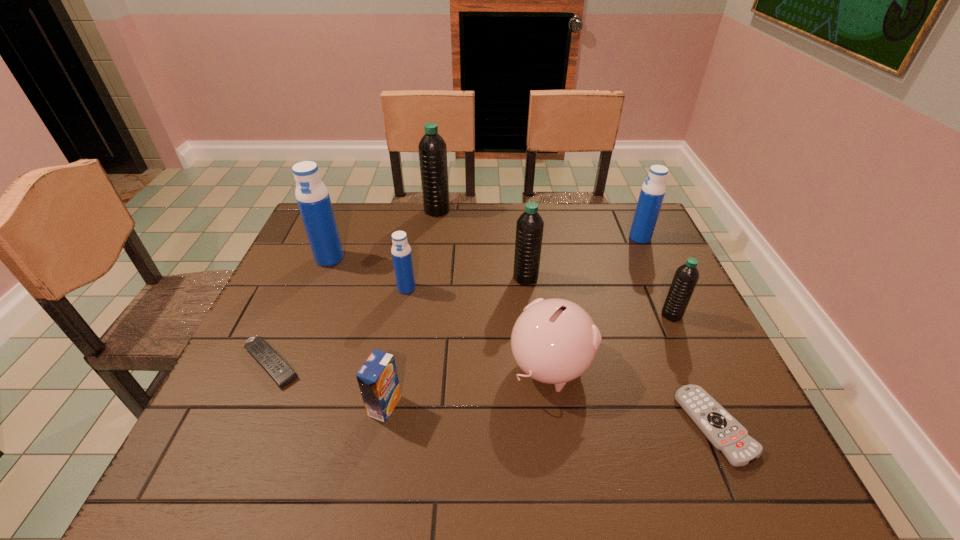
The height and width of the screenshot is (540, 960). Identify the location of remote control located in the left edge section of the desktop. (266, 356).

You are a GUI agent. You are given a task and a screenshot of the screen. Output one action in this format:
    pyautogui.click(x=<x>, y=<y>)
    Task: Click on the remote control present at the right edge
    
    Given the screenshot: What is the action you would take?
    pyautogui.click(x=724, y=432)

Where is `object that is at the far right corner`? This screenshot has width=960, height=540. object that is at the far right corner is located at coordinates (652, 193).

Where is `object present at the near right corner`? The width and height of the screenshot is (960, 540). object present at the near right corner is located at coordinates (724, 432).

In the image, there is a desktop. At what (x,y) coordinates should I click in order to perform the action: click on vacant space at the near edge. Please return your answer as a coordinate pair (x, y). The image size is (960, 540). Looking at the image, I should click on (479, 463).

The height and width of the screenshot is (540, 960). In the image, there is a desktop. Identify the location of free space at the left edge. (297, 360).

In the image, there is a desktop. Identify the location of free space at the right edge. click(662, 319).

Locate an element on the screen. The image size is (960, 540). vacant area at the near left corner of the desktop is located at coordinates (197, 473).

You are a GUI agent. You are given a task and a screenshot of the screen. Output one action in this format:
    pyautogui.click(x=<x>, y=<y>)
    Task: Click on the vacant space at the far right corner of the desktop
    
    Given the screenshot: What is the action you would take?
    pyautogui.click(x=611, y=226)

Locate an element on the screen. This screenshot has height=540, width=960. blank region between the eighth nearest object and the farthest water bottle is located at coordinates (383, 234).